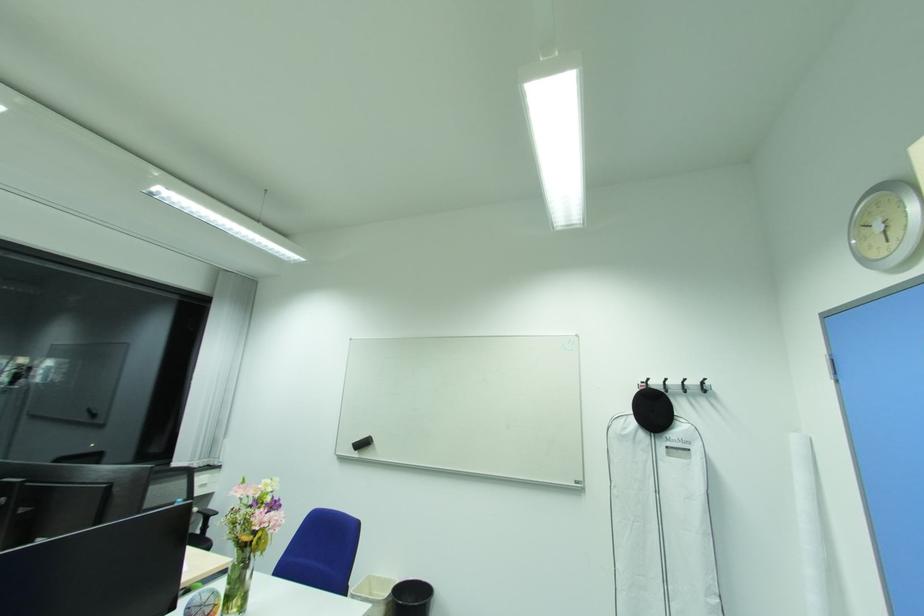
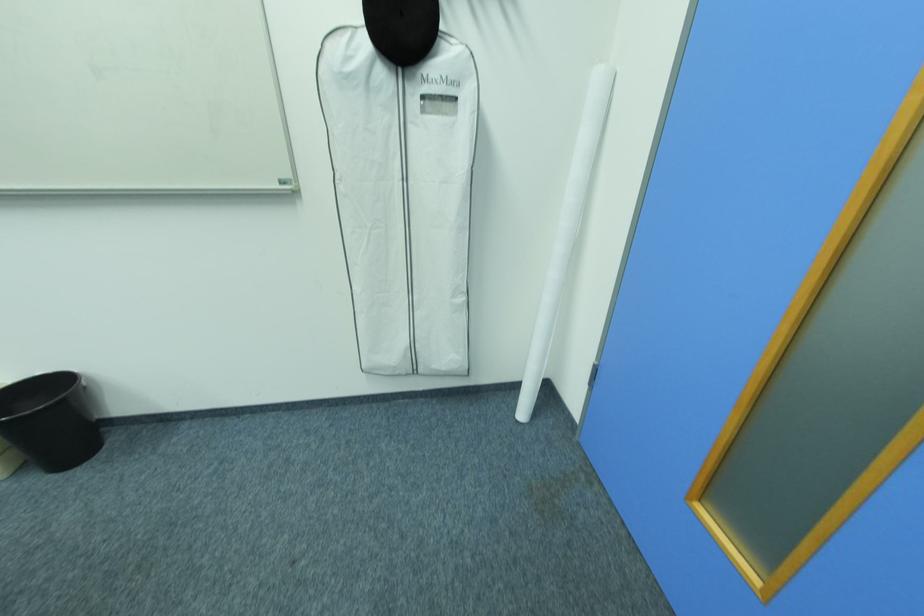
Find the pixel in the second image that matches (404,580) in the first image.

(17, 382)